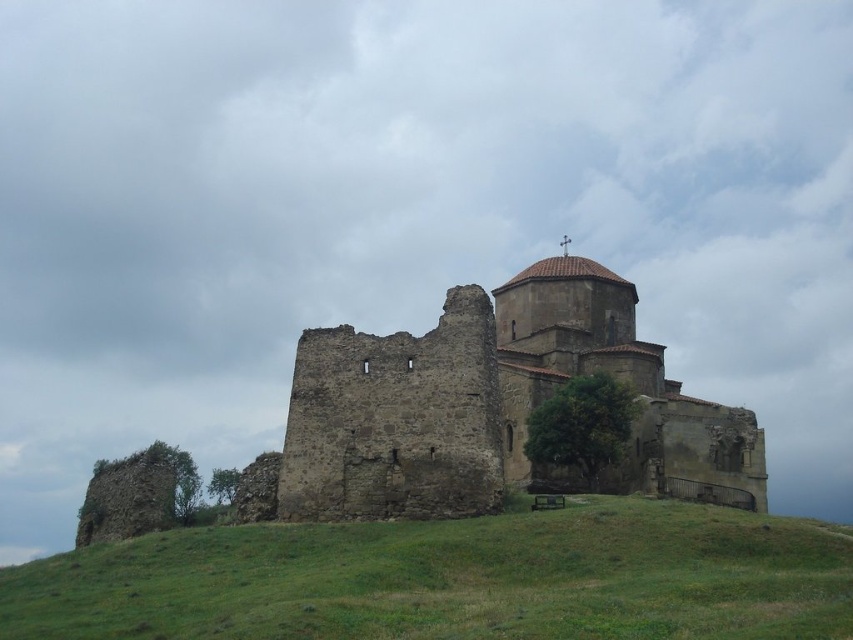
Question: Is green grassy hillside at lower center closer to camera compared to rustic stone castle at center?

Choices:
 (A) yes
 (B) no

Answer: (A)

Question: Which of the following is the farthest from the observer?

Choices:
 (A) rustic stone castle at center
 (B) green grassy hillside at lower center

Answer: (A)

Question: Does green grassy hillside at lower center appear under rustic stone castle at center?

Choices:
 (A) no
 (B) yes

Answer: (B)

Question: Observing the image, what is the correct spatial positioning of green grassy hillside at lower center in reference to rustic stone castle at center?

Choices:
 (A) left
 (B) right

Answer: (A)